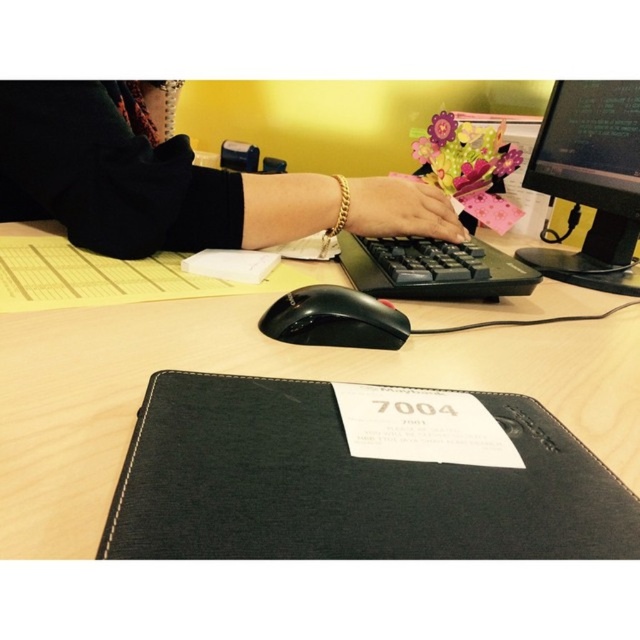
Question: Among these objects, which one is nearest to the camera?

Choices:
 (A) black plastic monitor at upper right
 (B) gold bracelet at center

Answer: (B)

Question: Is black leather folder at center below gold bracelet at center?

Choices:
 (A) yes
 (B) no

Answer: (A)

Question: Which of the following is the closest to the observer?

Choices:
 (A) (538, 276)
 (B) (300, 316)
 (C) (588, 355)
 (D) (412, 218)

Answer: (B)

Question: Which point is closer to the camera?

Choices:
 (A) (432, 264)
 (B) (486, 336)
 (C) (76, 211)
 (D) (364, 193)

Answer: (B)

Question: Is black plastic keyboard at center positioned at the back of black plastic mouse at center?

Choices:
 (A) yes
 (B) no

Answer: (A)

Question: Is black leather folder at center closer to camera compared to black plastic keyboard at center?

Choices:
 (A) yes
 (B) no

Answer: (A)